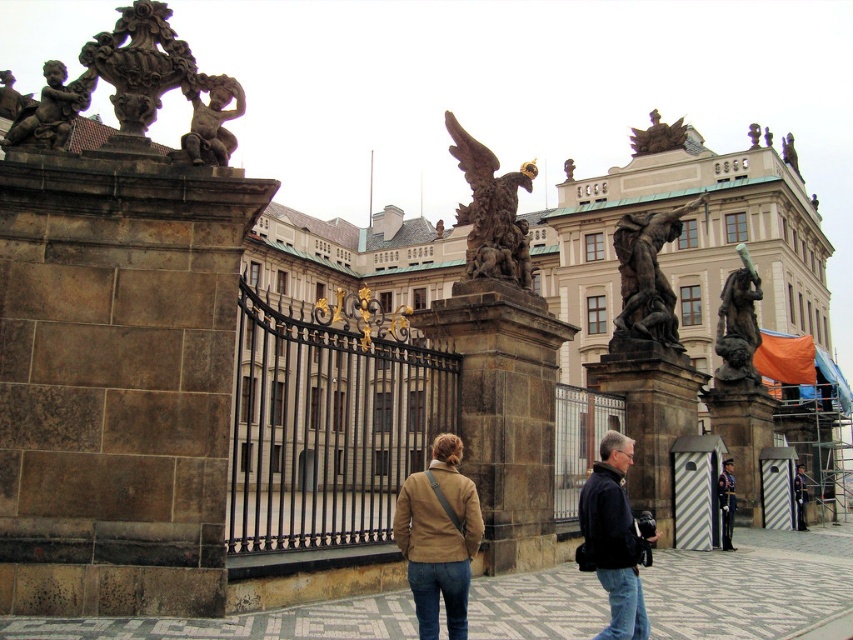
Question: Which point is closer to the camera taking this photo?

Choices:
 (A) (421, 600)
 (B) (85, 83)
 (C) (805, 490)
 (D) (376, 470)

Answer: (A)

Question: Is camel leather jacket at center positioned before polished stone eagle at center?

Choices:
 (A) no
 (B) yes

Answer: (B)

Question: Is polished stone eagle at center below bronze textured statue at center right?

Choices:
 (A) no
 (B) yes

Answer: (A)

Question: Which object is farther from the camera taking this photo?

Choices:
 (A) bronze textured statue at center right
 (B) camel leather jacket at center

Answer: (A)

Question: Can you confirm if brown leather jacket at center is wider than dark blue uniform at center right?

Choices:
 (A) yes
 (B) no

Answer: (A)

Question: Which object appears farthest from the camera in this image?

Choices:
 (A) polished stone eagle at center
 (B) bronze textured statue at center right
 (C) camel leather jacket at center
 (D) bronze statue at right

Answer: (D)